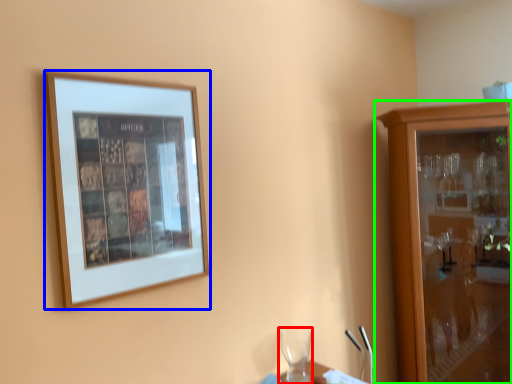
Question: Estimate the real-world distances between objects in this image. Which object is closer to wine glass (highlighted by a red box), picture frame (highlighted by a blue box) or cabinetry (highlighted by a green box)?

Choices:
 (A) picture frame
 (B) cabinetry

Answer: (B)